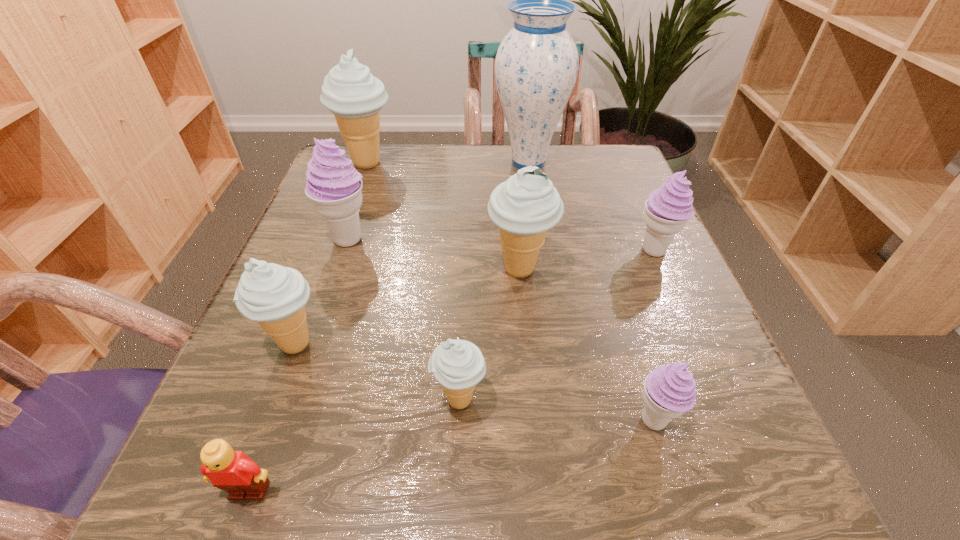
You are a GUI agent. You are given a task and a screenshot of the screen. Output one action in this format:
    pyautogui.click(x=<x>, y=<y>)
    Task: Click on the tallest object
    
    Given the screenshot: What is the action you would take?
    pyautogui.click(x=536, y=66)

The height and width of the screenshot is (540, 960). Find the location of `vase`. vase is located at coordinates (536, 66).

Find the location of a particular element. The height and width of the screenshot is (540, 960). the tallest icecream is located at coordinates (349, 91).

I want to click on the farthest beige icecream, so click(x=349, y=91).

At what (x,y) coordinates should I click in order to perform the action: click on the fifth icecream from left to right. Please return your answer as a coordinate pair (x, y). Looking at the image, I should click on (526, 205).

Find the location of `the rightmost beige icecream`. the rightmost beige icecream is located at coordinates (526, 205).

Identify the location of the leftmost purple icecream. (334, 187).

Locate an element on the screen. The image size is (960, 540). the fourth nearest object is located at coordinates (274, 295).

The height and width of the screenshot is (540, 960). Find the location of `the second smallest beige icecream`. the second smallest beige icecream is located at coordinates (274, 295).

Image resolution: width=960 pixels, height=540 pixels. I want to click on the second biggest purple icecream, so pyautogui.click(x=668, y=208).